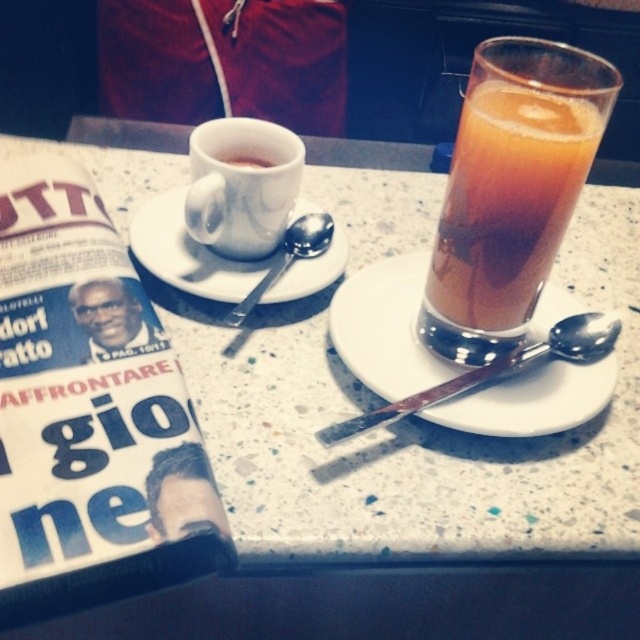
Question: Does white ceramic saucer at center appear over matte white cup at upper center?

Choices:
 (A) yes
 (B) no

Answer: (B)

Question: Estimate the real-world distances between objects in this image. Which object is farther from the white glossy cup at center?

Choices:
 (A) translucent glass beverage at upper right
 (B) white ceramic saucer at center
 (C) matte white cup at upper center
 (D) white marble saucer at center

Answer: (A)

Question: Can you confirm if translucent glass beverage at upper right is positioned below white ceramic saucer at center?

Choices:
 (A) no
 (B) yes

Answer: (A)

Question: Can you confirm if white ceramic saucer at center is wider than white glossy cup at center?

Choices:
 (A) no
 (B) yes

Answer: (B)

Question: Which of the following is the farthest from the observer?

Choices:
 (A) white glossy cup at center
 (B) white marble saucer at center
 (C) white ceramic saucer at center

Answer: (B)

Question: Which object is positioned closest to the white marble saucer at center?

Choices:
 (A) white ceramic saucer at center
 (B) translucent glass beverage at upper right
 (C) white glossy cup at center

Answer: (C)